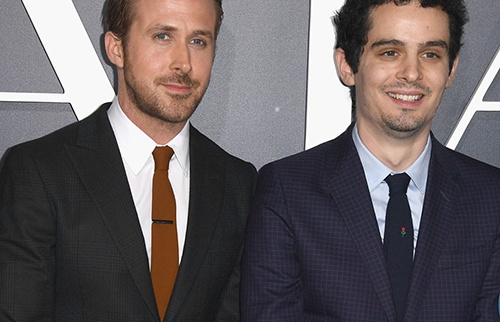
Where is `white  trim`? The image size is (500, 322). white  trim is located at coordinates (61, 67), (37, 99), (320, 100), (466, 126), (486, 109).